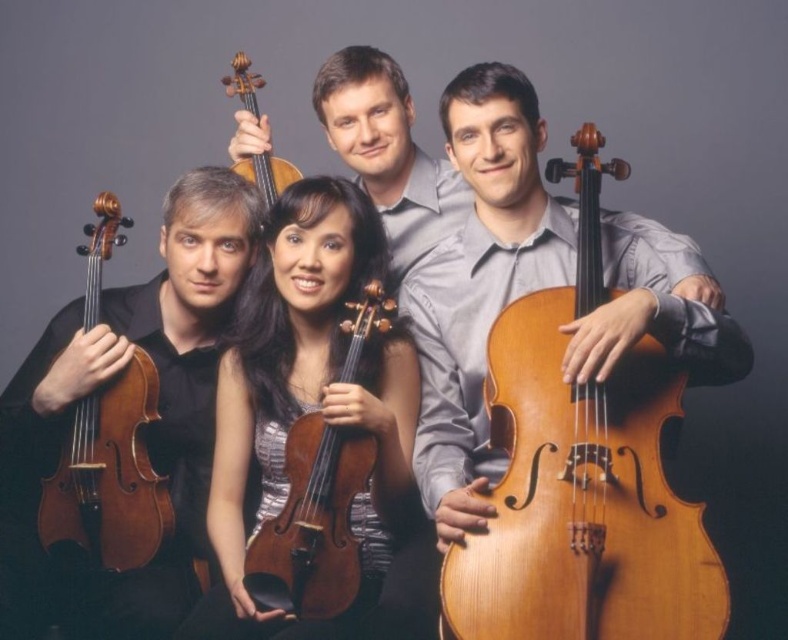
Question: Which of the following is the farthest from the observer?

Choices:
 (A) (207, 308)
 (B) (279, 168)

Answer: (B)

Question: Does matte black violin at left have a greater width compared to wooden violin at left?

Choices:
 (A) yes
 (B) no

Answer: (A)

Question: Which of these objects is positioned farthest from the wooden violin at left?

Choices:
 (A) matte gray shirt at upper center
 (B) wooden violin at center
 (C) shiny brown violin at center
 (D) matte black violin at left

Answer: (A)

Question: Does matte black violin at left appear on the left side of matte gray shirt at upper center?

Choices:
 (A) no
 (B) yes

Answer: (B)

Question: Is light brown polished wood cello at right to the left of wooden violin at center from the viewer's perspective?

Choices:
 (A) yes
 (B) no

Answer: (B)

Question: Estimate the real-world distances between objects in this image. Which object is farther from the wooden violin at left?

Choices:
 (A) light brown polished wood cello at right
 (B) shiny brown violin at center
 (C) matte brown violin at upper center
 (D) matte gray shirt at upper center

Answer: (A)